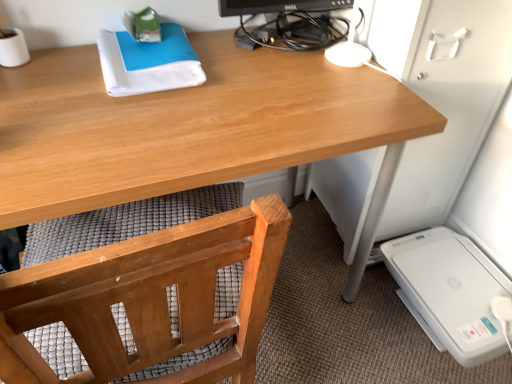
Locate an element on the screen. free space in front of black glossy monitor at upper center is located at coordinates (289, 101).